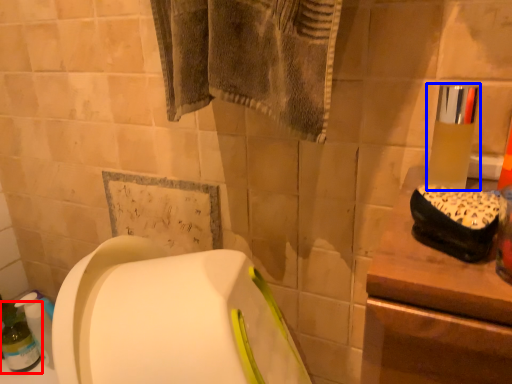
Question: Among these objects, which one is farthest to the camera, bottle (highlighted by a red box) or mouthwash (highlighted by a blue box)?

Choices:
 (A) bottle
 (B) mouthwash

Answer: (A)